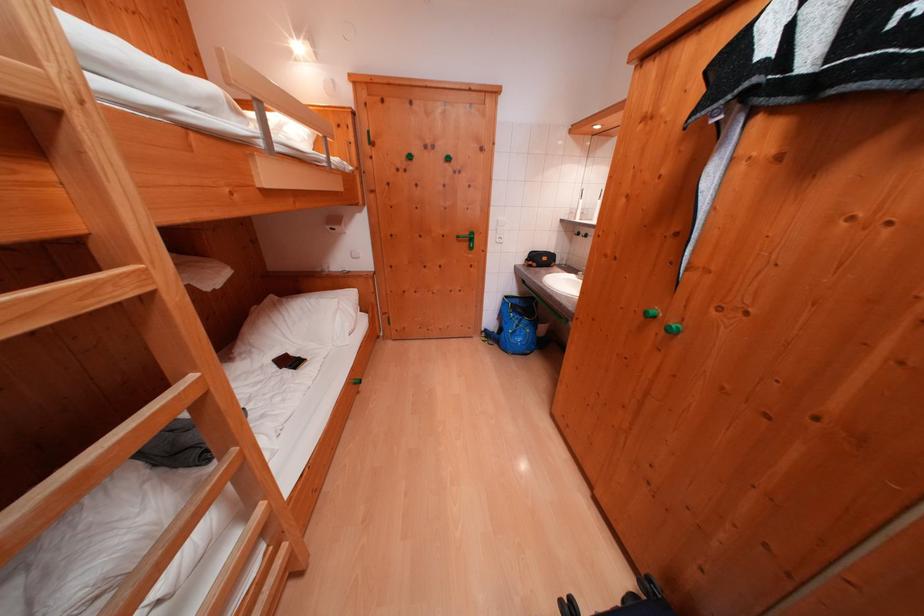
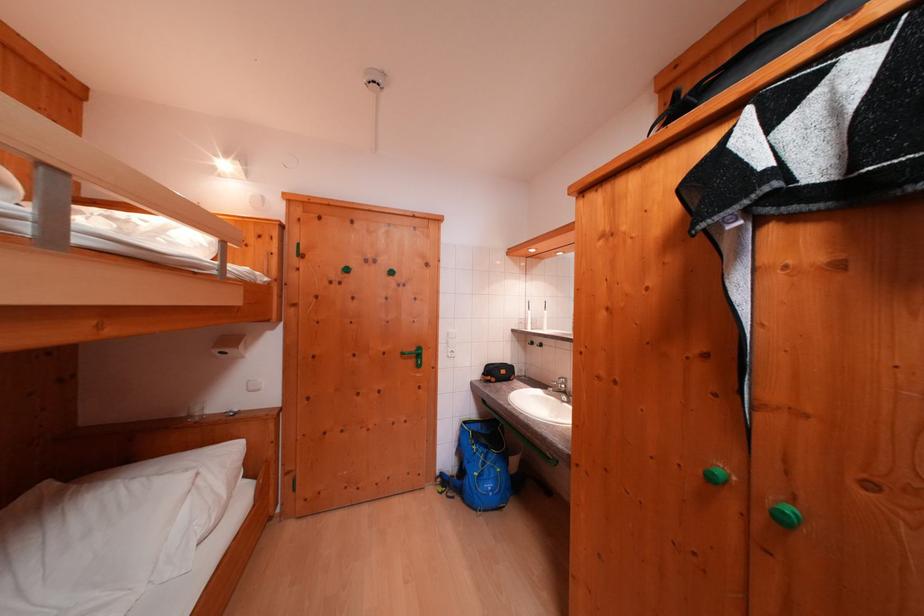
Question: The images are taken continuously from a first-person perspective. In which direction is your viewpoint rotating?

Choices:
 (A) Left
 (B) Right
 (C) Up
 (D) Down

Answer: (C)